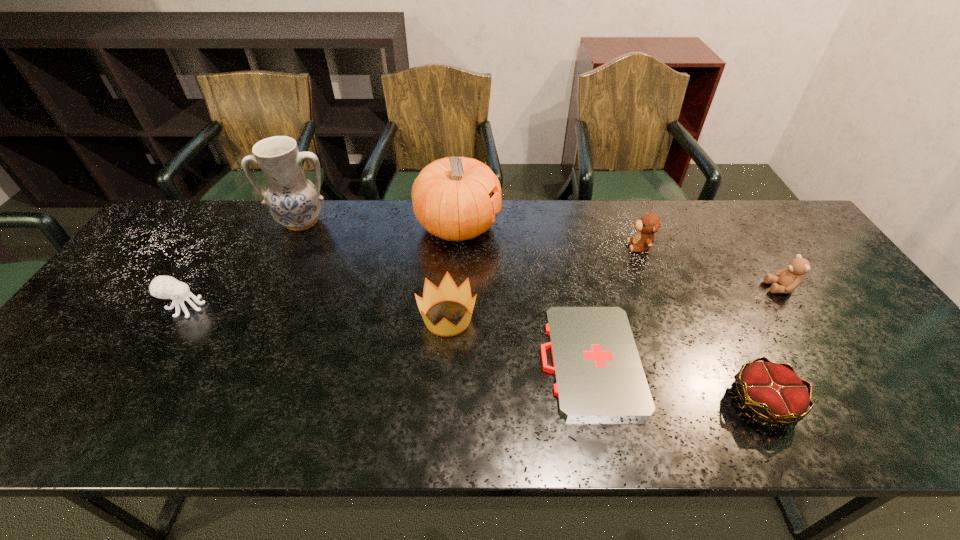
The width and height of the screenshot is (960, 540). Identify the location of empty space between the right teddy bear and the second object from right to left. (771, 345).

Identify the location of empty space between the farther teddy bear and the pumpkin. Image resolution: width=960 pixels, height=540 pixels. (549, 237).

The height and width of the screenshot is (540, 960). I want to click on empty space between the seventh object from right to left and the leftmost object, so click(244, 265).

In order to click on vacant space that is in between the rightmost object and the farther crown in this screenshot , I will do `click(614, 303)`.

Identify the location of blank region between the fourth object from right to left and the farther crown. tap(518, 339).

Where is `free space between the second shortest object and the pottery`? The width and height of the screenshot is (960, 540). free space between the second shortest object and the pottery is located at coordinates (532, 312).

The width and height of the screenshot is (960, 540). In order to click on free space that is in between the farther crown and the sixth object from left to right in this screenshot , I will do `click(543, 282)`.

At what (x,y) coordinates should I click in order to perform the action: click on free spot between the fifth object from left to right and the third object from right to left. Please return your answer as a coordinate pair (x, y). Looking at the image, I should click on (614, 303).

Locate which object ranks in proximity to the farther crown. Please provide its 2D coordinates. Your answer should be formatted as a tuple, i.e. [(x, y)], where the tuple contains the x and y coordinates of a point satisfying the conditions above.

[(598, 373)]

Select which object appears as the third closest to the farther teddy bear. Please provide its 2D coordinates. Your answer should be formatted as a tuple, i.e. [(x, y)], where the tuple contains the x and y coordinates of a point satisfying the conditions above.

[(451, 196)]